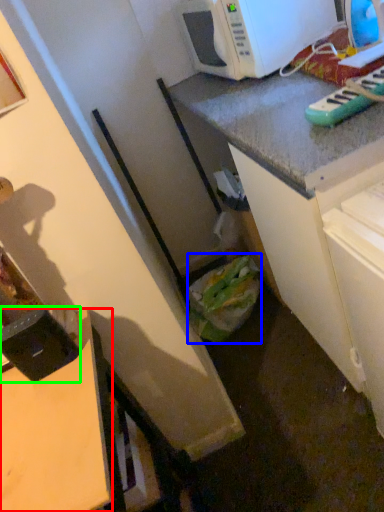
Question: Which object is the closest to the desk (highlighted by a red box)? Choose among these: garbage (highlighted by a blue box) or appliance (highlighted by a green box).

Choices:
 (A) garbage
 (B) appliance

Answer: (B)